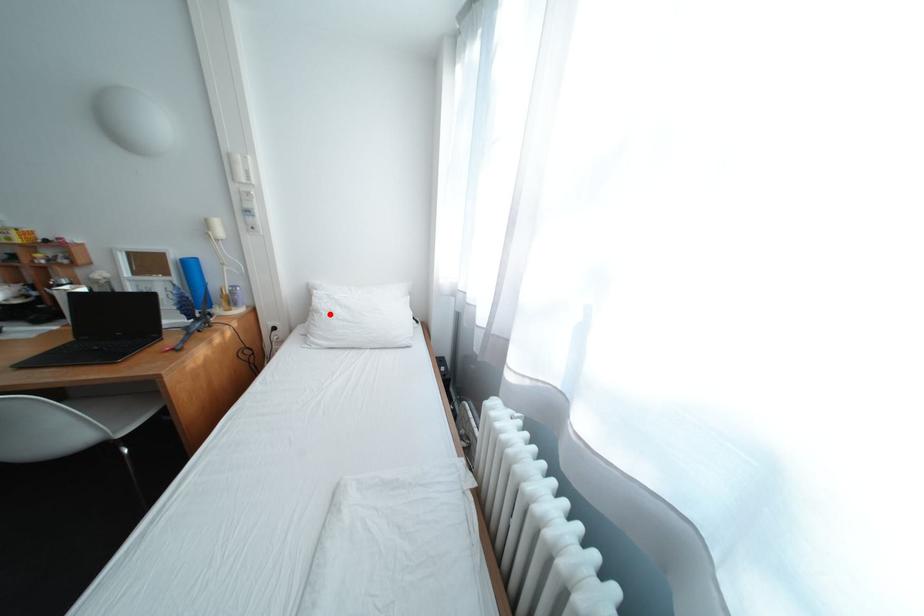
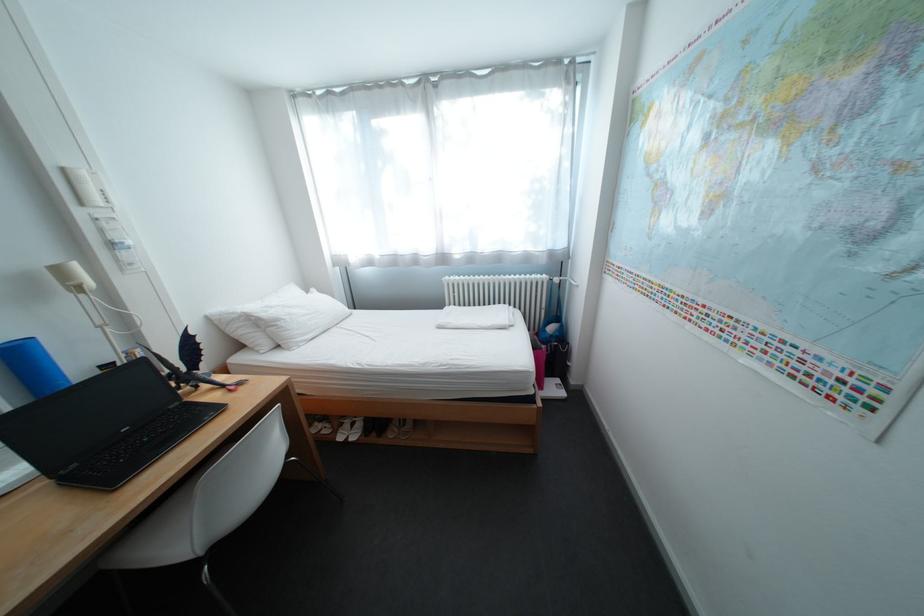
Question: I am providing you with two images of the same scene from different viewpoints. A red point is marked on the first image. Is the red point's position out of view in image 2?

Choices:
 (A) Yes
 (B) No

Answer: (B)